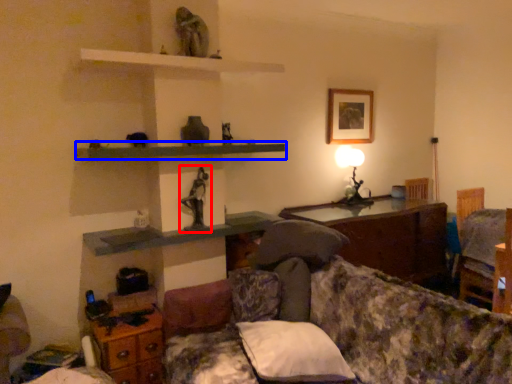
Question: Which point is closer to the camera, sculpture (highlighted by a red box) or shelf (highlighted by a blue box)?

Choices:
 (A) sculpture
 (B) shelf

Answer: (B)